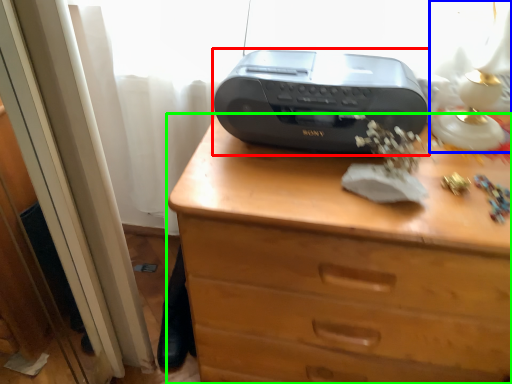
Question: Which is nearer to the printer (highlighted by a red box)? table lamp (highlighted by a blue box) or chest of drawers (highlighted by a green box).

Choices:
 (A) table lamp
 (B) chest of drawers

Answer: (B)